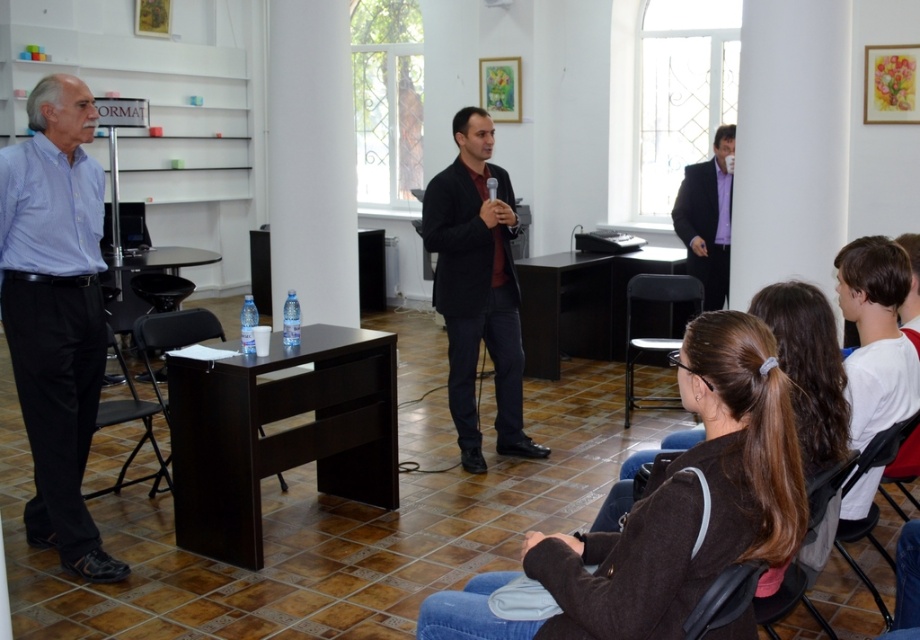
Question: Estimate the real-world distances between objects in this image. Which object is closer to the black leather chair at lower right?

Choices:
 (A) black plastic chair at lower center
 (B) purple glossy shirt at center
 (C) black plastic chair at left

Answer: (A)

Question: Does light blue shirt at left appear under black plastic chair at left?

Choices:
 (A) yes
 (B) no

Answer: (B)

Question: Which point is farther from the camera taking this photo?

Choices:
 (A) (763, 624)
 (B) (176, 326)
 (C) (732, 566)

Answer: (B)

Question: Is black plastic chair at lower center smaller than brown leather chair at lower right?

Choices:
 (A) yes
 (B) no

Answer: (B)

Question: Is purple glossy shirt at center closer to camera compared to brown leather chair at lower right?

Choices:
 (A) no
 (B) yes

Answer: (A)

Question: Which of the following is the closest to the observer?

Choices:
 (A) (177, 316)
 (B) (797, 600)

Answer: (B)